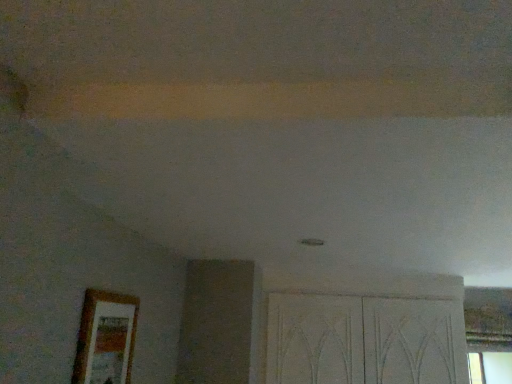
Question: Can you confirm if wooden picture frame at lower left is shorter than white textured screen door at lower right?

Choices:
 (A) yes
 (B) no

Answer: (A)

Question: Is wooden picture frame at lower left far from white textured screen door at lower right?

Choices:
 (A) no
 (B) yes

Answer: (B)

Question: From a real-world perspective, does wooden picture frame at lower left sit lower than white textured screen door at lower right?

Choices:
 (A) yes
 (B) no

Answer: (A)

Question: Does wooden picture frame at lower left have a lesser width compared to white textured screen door at lower right?

Choices:
 (A) yes
 (B) no

Answer: (A)

Question: Is white textured screen door at lower right at the back of wooden picture frame at lower left?

Choices:
 (A) no
 (B) yes

Answer: (A)

Question: Does wooden picture frame at lower left come behind white textured screen door at lower right?

Choices:
 (A) yes
 (B) no

Answer: (B)

Question: Is white textured screen door at lower right positioned beyond the bounds of wooden picture frame at lower left?

Choices:
 (A) yes
 (B) no

Answer: (A)

Question: Is white textured screen door at lower right further to the viewer compared to wooden picture frame at lower left?

Choices:
 (A) yes
 (B) no

Answer: (A)

Question: Is white textured screen door at lower right far from wooden picture frame at lower left?

Choices:
 (A) no
 (B) yes

Answer: (B)

Question: From a real-world perspective, is white textured screen door at lower right under wooden picture frame at lower left?

Choices:
 (A) yes
 (B) no

Answer: (B)

Question: Considering the relative positions of white textured screen door at lower right and wooden picture frame at lower left in the image provided, is white textured screen door at lower right to the right of wooden picture frame at lower left from the viewer's perspective?

Choices:
 (A) no
 (B) yes

Answer: (B)

Question: Is white textured screen door at lower right next to wooden picture frame at lower left and touching it?

Choices:
 (A) yes
 (B) no

Answer: (B)

Question: In the image, is wooden picture frame at lower left on the left side or the right side of white textured screen door at lower right?

Choices:
 (A) right
 (B) left

Answer: (B)